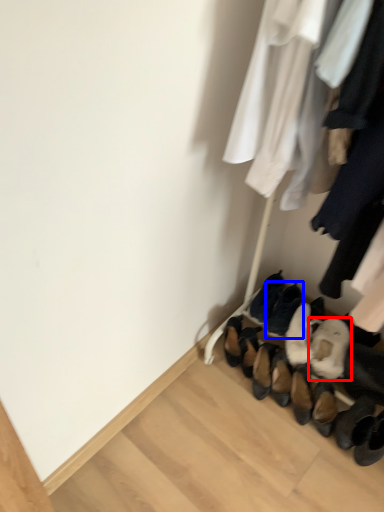
Question: Which object appears closest to the camera in this image, footwear (highlighted by a red box) or footwear (highlighted by a blue box)?

Choices:
 (A) footwear
 (B) footwear

Answer: (A)